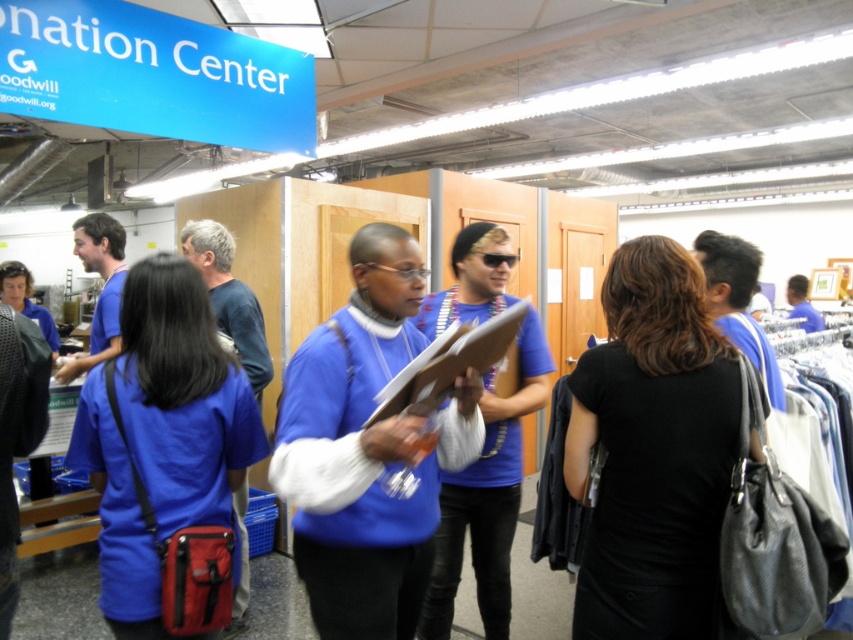
You are a volunteer at the Goodwill donation center. You need to place a black leather purse at center into a storage bin that is 1.5 meters away from the camera. Can you safely place it there without moving the camera?

The black leather purse at center and the camera are 1.49 meters apart. Since the storage bin is 1.5 meters away from the camera, the distance is slightly farther than the purse is currently from the camera. Therefore, you can safely place the black leather purse at center into the storage bin without moving the camera.

Looking at this image, you are a volunteer at the Goodwill donation center and need to place a new donation box between the black leather purse at center and the matte blue shirt at center. The box requires a minimum of 3 feet of space to fit. Can you fit the box between them?

The black leather purse at center and matte blue shirt at center are 35.00 inches apart from each other. Since 3 feet equals 36 inches, the distance between them is insufficient to accommodate the box requiring 36 inches of space.

You are standing at the entrance of the Goodwill donation center. You need to locate the black leather purse at center. According to the coordinates provided, in which direction should you walk from your current position to reach it?

The black leather purse at center is located at coordinates point (653,449). Since you are at the entrance, you should walk towards the center of the room to reach it.